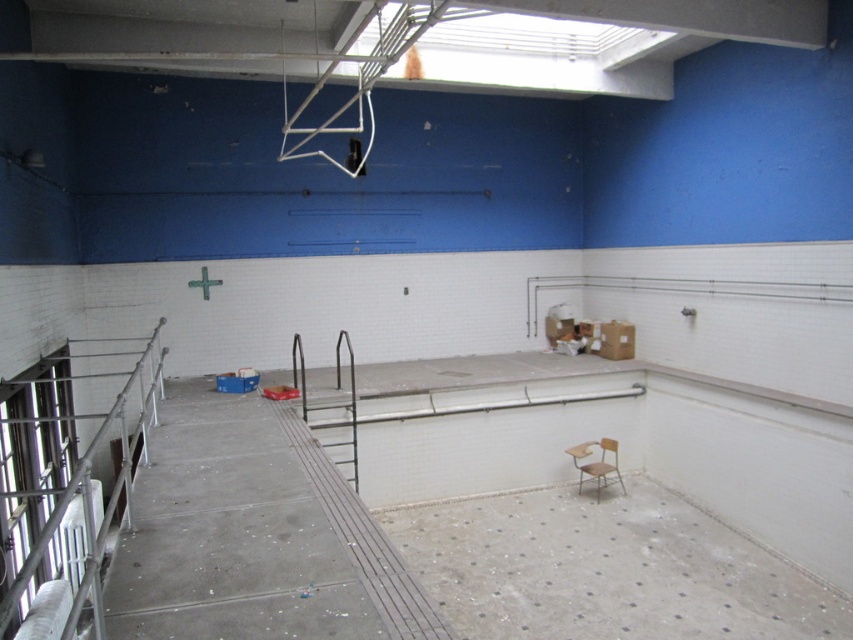
Question: Is silver metallic railing at left above metallic gray rail at center?

Choices:
 (A) no
 (B) yes

Answer: (B)

Question: From the image, what is the correct spatial relationship of silver metallic railing at left in relation to metallic gray rail at center?

Choices:
 (A) above
 (B) below

Answer: (A)

Question: Which of the following is the farthest from the observer?

Choices:
 (A) (16, 449)
 (B) (335, 445)
 (C) (582, 480)

Answer: (C)

Question: Which object is farther from the camera taking this photo?

Choices:
 (A) silver metallic railing at left
 (B) metallic gray rail at center
 (C) wooden chair at center

Answer: (C)

Question: Is silver metallic railing at left positioned at the back of wooden chair at center?

Choices:
 (A) no
 (B) yes

Answer: (A)

Question: Which of the following is the closest to the observer?

Choices:
 (A) wooden chair at center
 (B) metallic gray rail at center

Answer: (B)